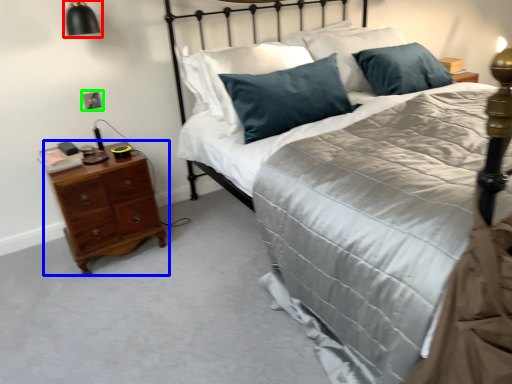
Question: Which object is the farthest from bedside lamp (highlighted by a red box)? Choose among these: nightstand (highlighted by a blue box) or electric outlet (highlighted by a green box).

Choices:
 (A) nightstand
 (B) electric outlet

Answer: (A)